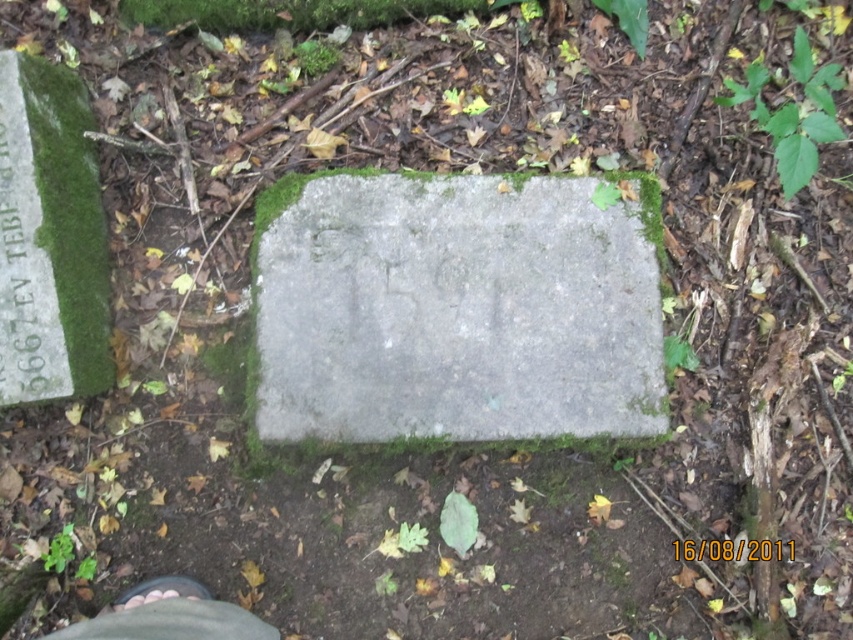
You are a hiker who has stumbled upon this stone marker in the forest. You notice the gray concrete at center and the brown leather shoe at lower left. Which object would you need to move if you want to place your backpack on the ground without disturbing the shoe?

The gray concrete at center is bigger than the brown leather shoe at lower left, so you should move the gray concrete at center to place your backpack without disturbing the shoe.

You are a geologist examining the gray concrete at center in a forest. Based on its position, what coordinates would you use to mark its location on your map?

The gray concrete at center is located at coordinates point (456, 308), so you should mark it there on your map.